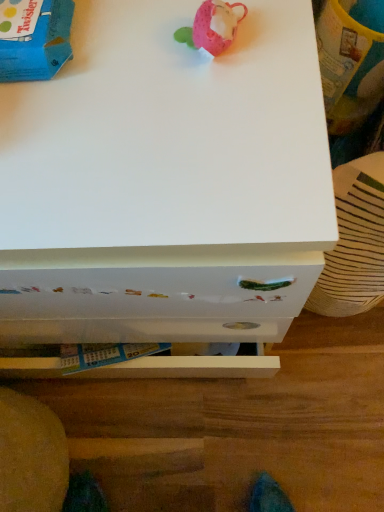
Question: Looking at the image, does blue cardboard box at upper left, which is counted as the first toy, starting from the left, seem bigger or smaller compared to white glossy drawer at lower center?

Choices:
 (A) big
 (B) small

Answer: (B)

Question: Is point (61, 56) positioned closer to the camera than point (226, 394)?

Choices:
 (A) closer
 (B) farther

Answer: (A)

Question: Based on their relative distances, which object is farther from the white glossy drawer at lower center?

Choices:
 (A) blue cardboard box at upper left, the 2th toy when ordered from right to left
 (B) pink fabric mouse at upper center, the 2th toy from the left
 (C) white painted wood chest of drawers at center

Answer: (A)

Question: Which is nearer to the white glossy drawer at lower center?

Choices:
 (A) white painted wood chest of drawers at center
 (B) blue cardboard box at upper left, the 2th toy when ordered from right to left
 (C) pink fabric mouse at upper center, which is counted as the 1th toy, starting from the right

Answer: (A)